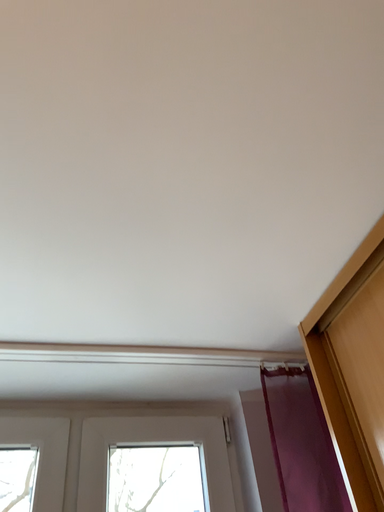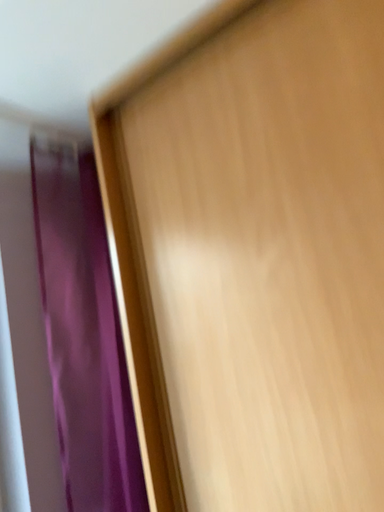
Question: Which way did the camera rotate in the video?

Choices:
 (A) rotated downward
 (B) rotated upward

Answer: (A)